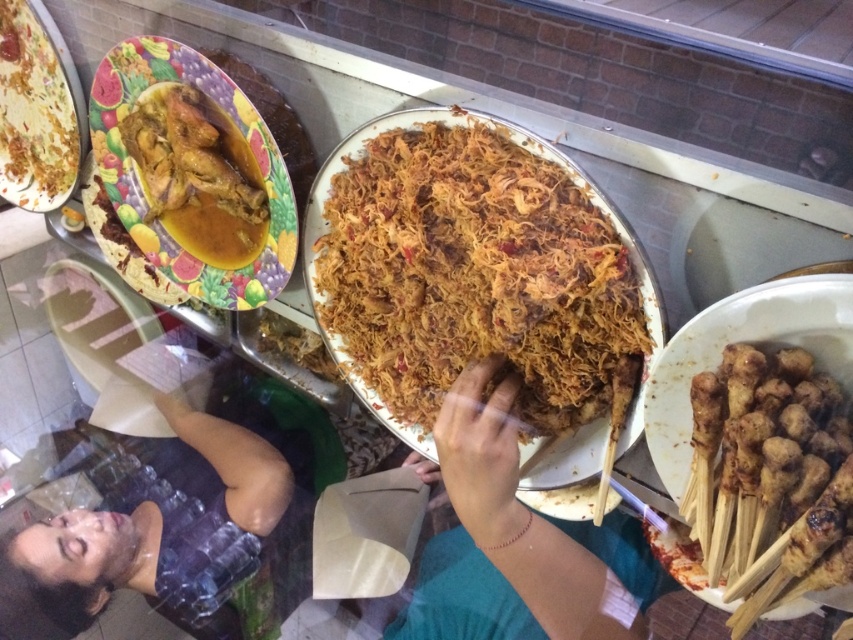
Based on the photo, you are a food critic observing the dishes at the food stall. You notice the brown matte hand at center and the yellow sauce with curry chicken at upper left. Which object is located below the other?

The brown matte hand at center is positioned under the yellow sauce with curry chicken at upper left, so the hand is below the curry chicken sauce.

You are a customer at the food stall and want to grab both the brown matte skewers at lower right and the yellow sauce with curry chicken at upper left. Which one should you reach for first if you want to pick up the one closer to you?

The brown matte skewers at lower right is in front of the yellow sauce with curry chicken at upper left, so you should reach for the brown matte skewers at lower right first since it is closer to you.

You are a food critic who wants to compare the brown matte skewers at lower right and the yellow sauce with curry chicken at upper left. Which of the two items is thinner?

The brown matte skewers at lower right are thinner than the yellow sauce with curry chicken at upper left according to the description.